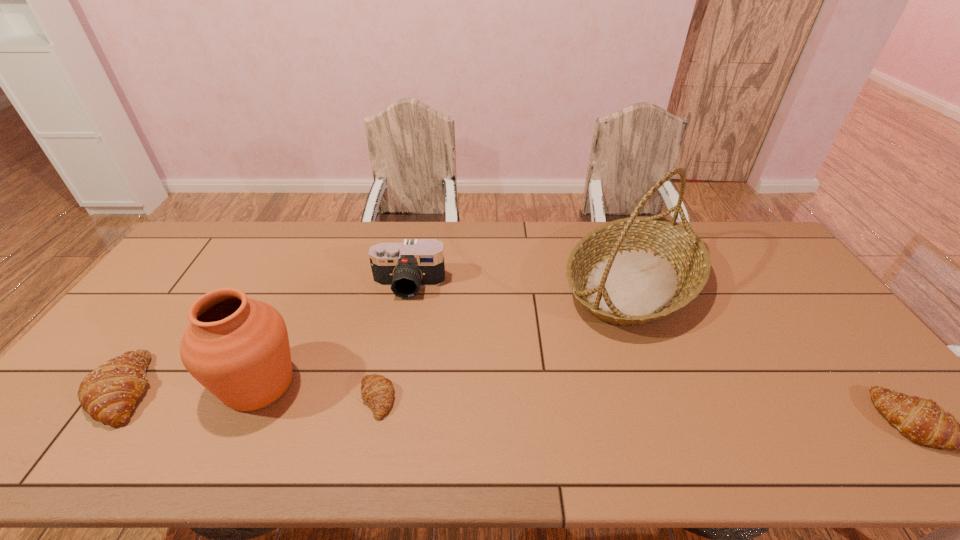
The width and height of the screenshot is (960, 540). In order to click on the leftmost crescent roll in this screenshot , I will do `click(108, 394)`.

The image size is (960, 540). Find the location of `the shortest crescent roll`. the shortest crescent roll is located at coordinates (377, 390).

This screenshot has height=540, width=960. In order to click on the second crescent roll from right to left in this screenshot , I will do `click(377, 390)`.

At what (x,y) coordinates should I click in order to perform the action: click on the fifth object from left to right. Please return your answer as a coordinate pair (x, y). Looking at the image, I should click on (633, 271).

Identify the location of basket. (633, 271).

This screenshot has height=540, width=960. I want to click on camera, so click(405, 267).

The image size is (960, 540). Find the location of `the fifth object from right to left`. the fifth object from right to left is located at coordinates (238, 348).

The image size is (960, 540). I want to click on the fifth shortest object, so click(x=238, y=348).

Locate an element on the screen. vacant region located on the left of the leftmost object is located at coordinates (74, 389).

Identify the location of free point located on the back of the shortest object. (387, 348).